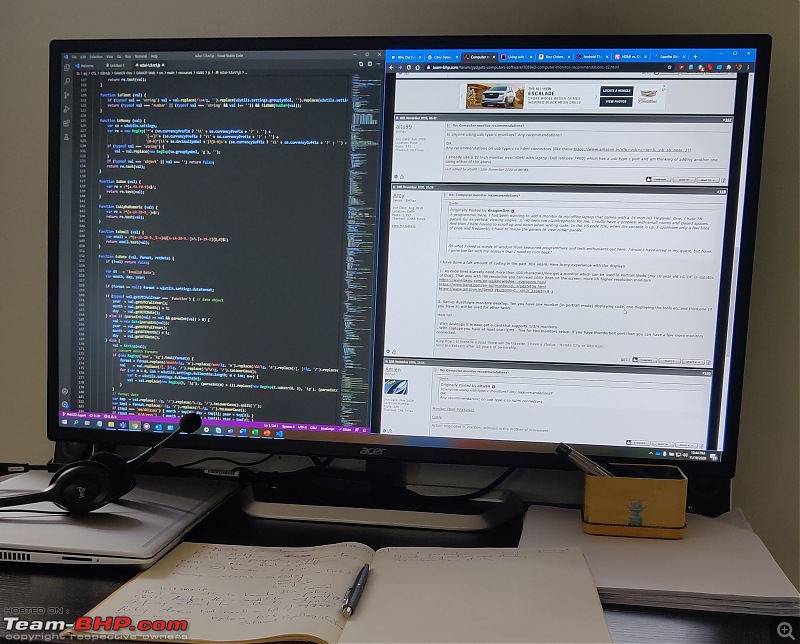
Where is `desk`? desk is located at coordinates (626, 616), (272, 535), (42, 592).